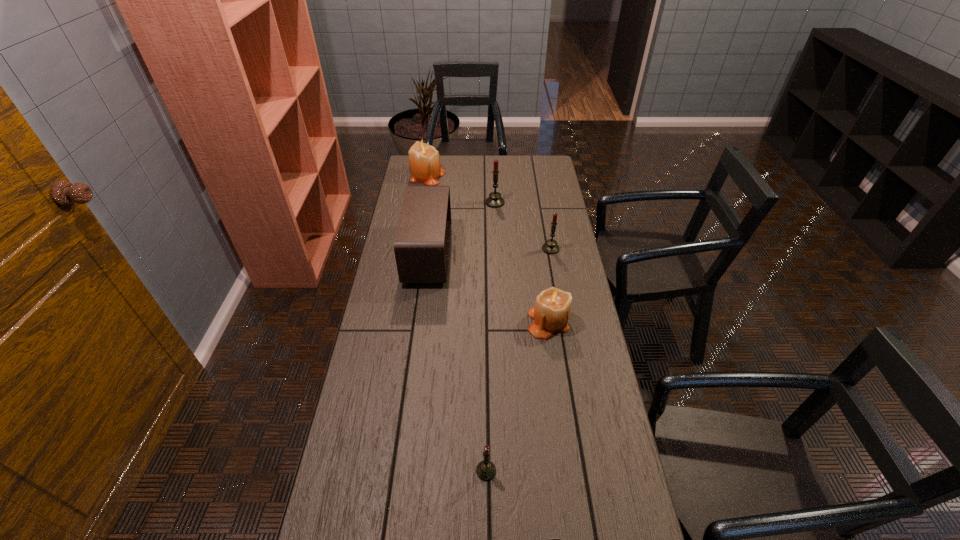
Locate an element on the screen. This screenshot has height=540, width=960. blank region between the nearest red candle and the rightmost red candle is located at coordinates (518, 360).

You are a GUI agent. You are given a task and a screenshot of the screen. Output one action in this format:
    pyautogui.click(x=<x>, y=<y>)
    Task: Click on the object that is the fifth closest one to the left beige candle
    This screenshot has width=960, height=540.
    Given the screenshot: What is the action you would take?
    pyautogui.click(x=486, y=470)

Locate which object is the fourth closest to the nearest object. Please provide its 2D coordinates. Your answer should be formatted as a tuple, i.e. [(x, y)], where the tuple contains the x and y coordinates of a point satisfying the conditions above.

[(550, 247)]

Identify the location of candle that stands as the third closest to the second biggest red candle. (424, 161).

Locate an element on the screen. The width and height of the screenshot is (960, 540). candle that stands as the second closest to the fourth farthest candle is located at coordinates (486, 470).

The height and width of the screenshot is (540, 960). What are the coordinates of `red candle that is the closest to the fourth nearest candle` in the screenshot? It's located at (550, 247).

You are a GUI agent. You are given a task and a screenshot of the screen. Output one action in this format:
    pyautogui.click(x=<x>, y=<y>)
    Task: Click on the red candle that is the closest to the biggest red candle
    
    Given the screenshot: What is the action you would take?
    pyautogui.click(x=550, y=247)

This screenshot has width=960, height=540. Identify the location of beige candle that is the second closest to the brown radio receiver. (424, 161).

Identify the location of free space that satisfies the following two spatial constraints: 1. on the front-facing side of the right beige candle; 2. on the right side of the radio receiver. The height and width of the screenshot is (540, 960). (420, 322).